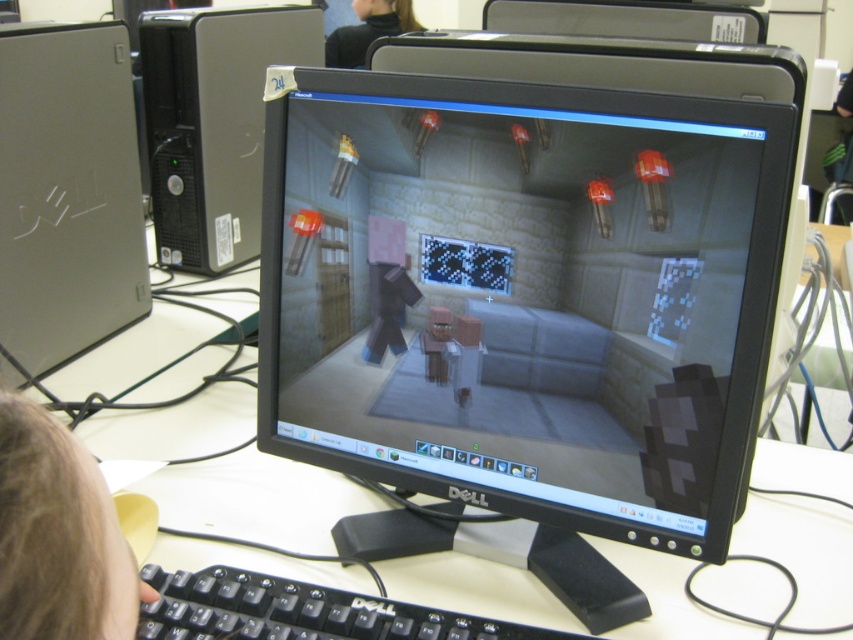
Question: Does white glossy computer desk at center have a smaller size compared to silver metallic computer tower at left?

Choices:
 (A) yes
 (B) no

Answer: (B)

Question: Does white glossy computer desk at center have a greater width compared to silver metallic computer tower at left?

Choices:
 (A) yes
 (B) no

Answer: (A)

Question: Can you confirm if brown hair at lower left is positioned below black plastic keyboard at lower center?

Choices:
 (A) no
 (B) yes

Answer: (A)

Question: Which point is farther to the camera?

Choices:
 (A) black plastic desktop tower at left
 (B) white glossy computer desk at center
 (C) brown hair at lower left

Answer: (A)

Question: Which object is the farthest from the black fabric at upper center?

Choices:
 (A) brown hair at lower left
 (B) white glossy computer desk at center
 (C) gray matte monitor at center

Answer: (A)

Question: Estimate the real-world distances between objects in this image. Which object is farther from the black fabric at upper center?

Choices:
 (A) brown hair at lower left
 (B) black plastic desktop tower at left
 (C) gray matte monitor at center

Answer: (A)